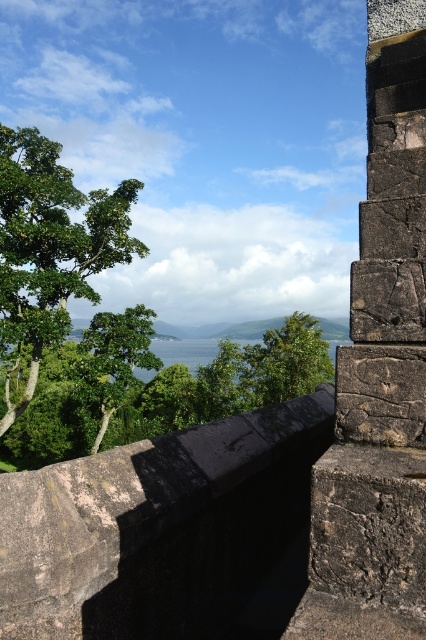
Question: Which point is closer to the camera?

Choices:
 (A) (32, 170)
 (B) (327, 376)

Answer: (A)

Question: Among these points, which one is nearest to the camera?

Choices:
 (A) (112, 259)
 (B) (250, 372)
 (C) (141, 493)

Answer: (C)

Question: Can you confirm if dark stone ledge at upper center is wider than green leafy tree at center?

Choices:
 (A) yes
 (B) no

Answer: (B)

Question: Is dark stone ledge at upper center thinner than green leafy tree at center?

Choices:
 (A) yes
 (B) no

Answer: (A)

Question: Which point is closer to the camera?

Choices:
 (A) green leafy tree at left
 (B) green leafy tree at center

Answer: (A)

Question: Can you confirm if green leafy tree at left is smaller than green leafy tree at center?

Choices:
 (A) no
 (B) yes

Answer: (A)